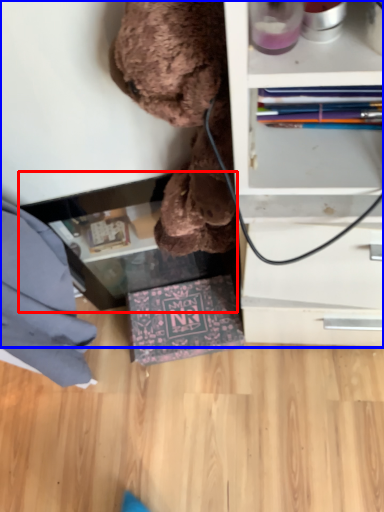
Question: Which object is closer to the camera taking this photo, table (highlighted by a red box) or shelf (highlighted by a blue box)?

Choices:
 (A) table
 (B) shelf

Answer: (B)